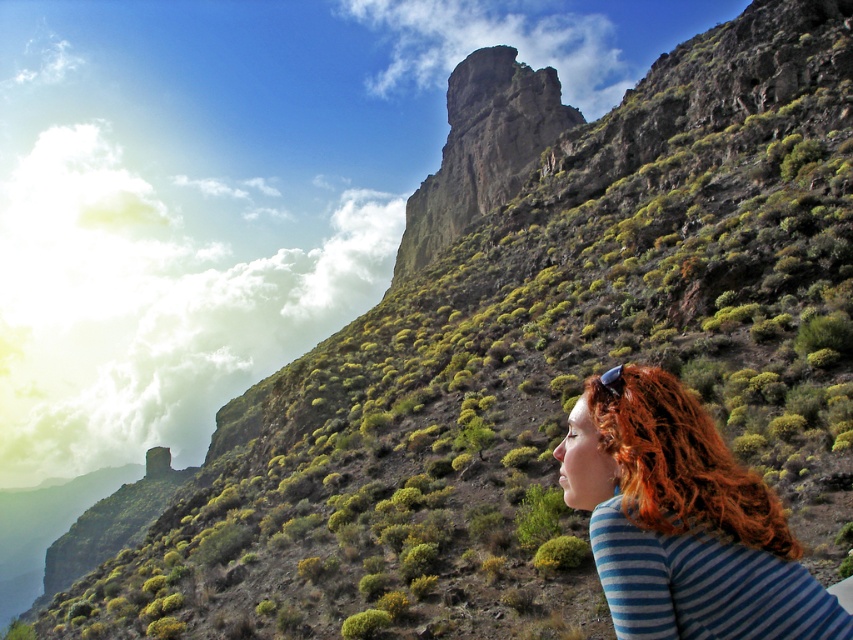
Question: Which point is farther from the camera taking this photo?

Choices:
 (A) (561, 484)
 (B) (431, 218)

Answer: (B)

Question: Among these points, which one is nearest to the camera?

Choices:
 (A) (405, 241)
 (B) (645, 540)

Answer: (B)

Question: Does blonde hair at lower right have a lesser width compared to rusty stone cliff at center?

Choices:
 (A) no
 (B) yes

Answer: (B)

Question: Does blonde hair at lower right have a smaller size compared to rusty stone cliff at center?

Choices:
 (A) no
 (B) yes

Answer: (B)

Question: Which object appears closest to the camera in this image?

Choices:
 (A) blonde hair at lower right
 (B) rusty stone cliff at center

Answer: (A)

Question: Is blonde hair at lower right above rusty stone cliff at center?

Choices:
 (A) no
 (B) yes

Answer: (A)